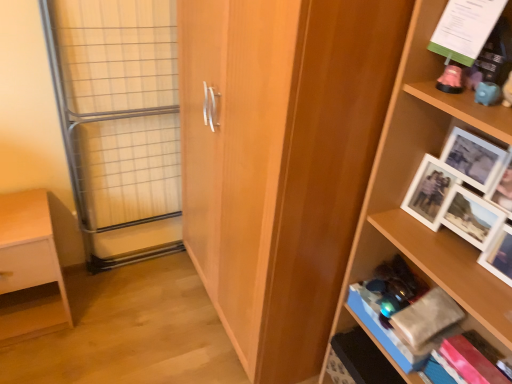
Identify the location of empty space that is to the right of white matte wooden shelf at lower left, acting as the first shelf starting from the left. (101, 321).